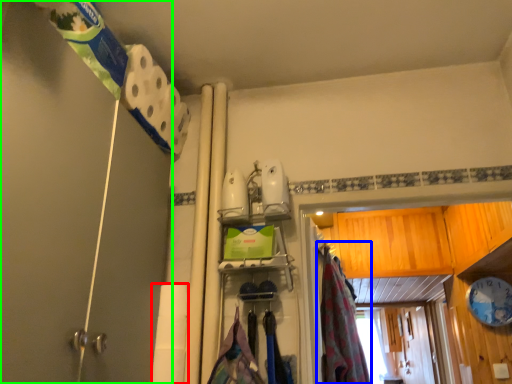
Question: Based on their relative distances, which object is nearer to toilet paper (highlighted by a red box)? Choose from curtain (highlighted by a blue box) and shower door (highlighted by a green box).

Choices:
 (A) curtain
 (B) shower door

Answer: (B)